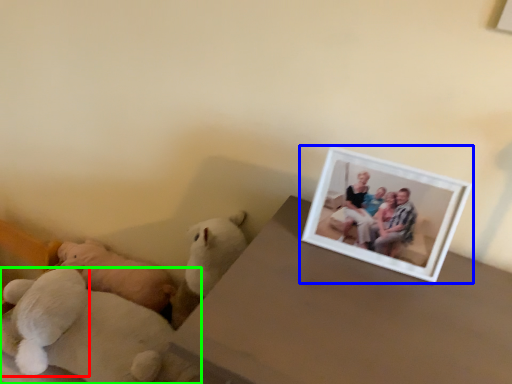
Question: Based on their relative distances, which object is farther from teddy bear (highlighted by a red box)? Choose from picture frame (highlighted by a blue box) and teddy bear (highlighted by a green box).

Choices:
 (A) picture frame
 (B) teddy bear

Answer: (A)